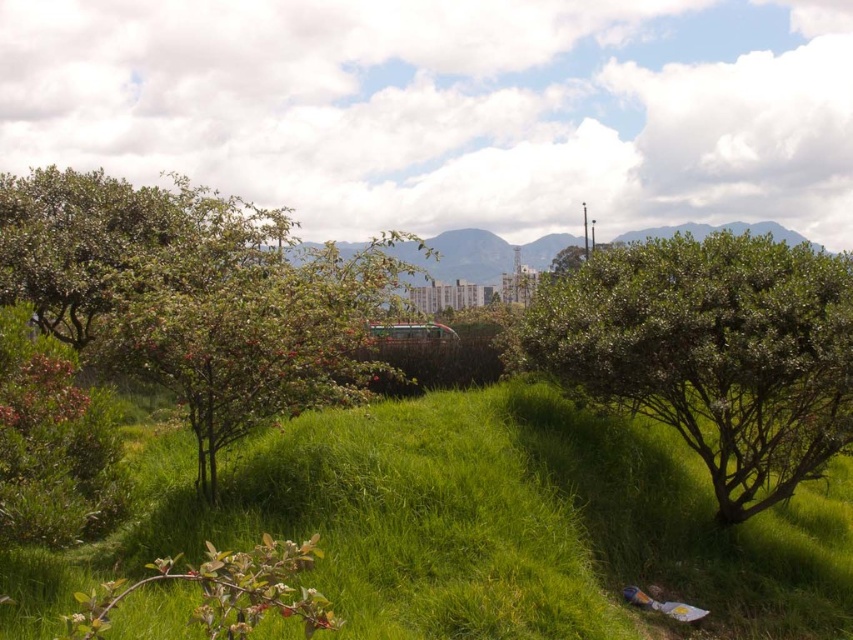
Question: Which of these objects is positioned closest to the green leafy bush at center?

Choices:
 (A) green leafy bush at left
 (B) green grass at center

Answer: (B)

Question: Considering the relative positions of green leafy bush at left and green leafy bush at center in the image provided, where is green leafy bush at left located with respect to green leafy bush at center?

Choices:
 (A) right
 (B) left

Answer: (B)

Question: From the image, what is the correct spatial relationship of green leafy bush at left in relation to green leafy bush at center?

Choices:
 (A) below
 (B) above

Answer: (B)

Question: Among these objects, which one is farthest from the camera?

Choices:
 (A) green leafy bush at left
 (B) green leafy bush at center
 (C) green grass at center

Answer: (B)

Question: Can you confirm if green grass at center is positioned below green leafy bush at left?

Choices:
 (A) no
 (B) yes

Answer: (B)

Question: Which point is closer to the camera?

Choices:
 (A) green grass at center
 (B) green leafy bush at center
 (C) green leafy bush at left

Answer: (A)